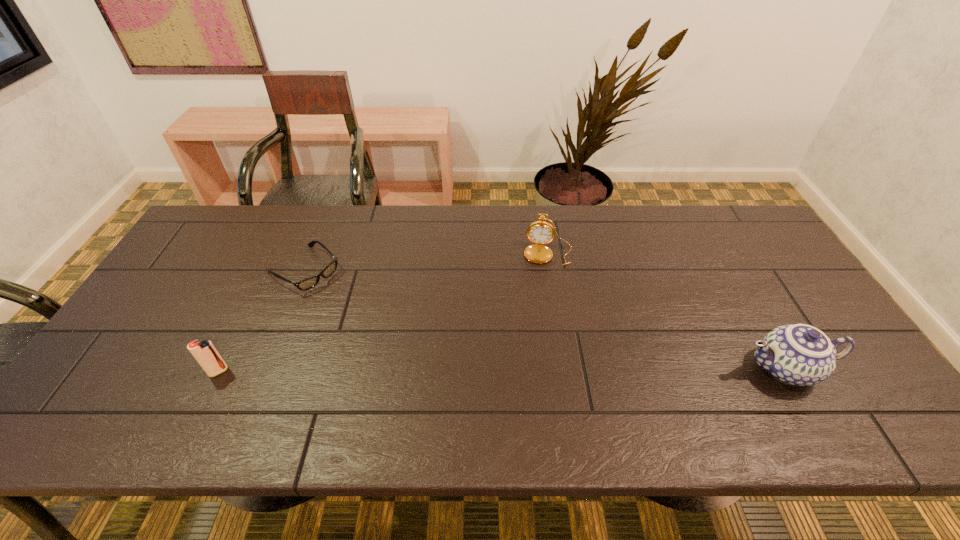
The image size is (960, 540). What are the coordinates of `unoccupied area between the chinaware and the spectacles` in the screenshot? It's located at (544, 319).

The width and height of the screenshot is (960, 540). In order to click on vacant space that's between the third object from left to right and the chinaware in this screenshot , I will do `click(667, 311)`.

Identify the location of free spot between the rightmost object and the second object from right to left. The image size is (960, 540). (667, 311).

Locate an element on the screen. vacant space that's between the third object from left to right and the shortest object is located at coordinates (426, 261).

Where is `vacant space that is in between the second object from right to left and the rightmost object`? vacant space that is in between the second object from right to left and the rightmost object is located at coordinates (667, 311).

The height and width of the screenshot is (540, 960). Find the location of `free point between the spectacles and the chinaware`. free point between the spectacles and the chinaware is located at coordinates (544, 319).

Select which object is the second closest to the chinaware. Please provide its 2D coordinates. Your answer should be formatted as a tuple, i.e. [(x, y)], where the tuple contains the x and y coordinates of a point satisfying the conditions above.

[(308, 283)]

Locate an element on the screen. object that is the second closest to the third object from left to right is located at coordinates (308, 283).

In order to click on vacant area in the image that satisfies the following two spatial constraints: 1. on the front side of the spectacles; 2. from the spout of the rightmost object in this screenshot , I will do `click(264, 368)`.

This screenshot has width=960, height=540. I want to click on free location that satisfies the following two spatial constraints: 1. on the back side of the second object from right to left; 2. on the right side of the igniter, so click(276, 253).